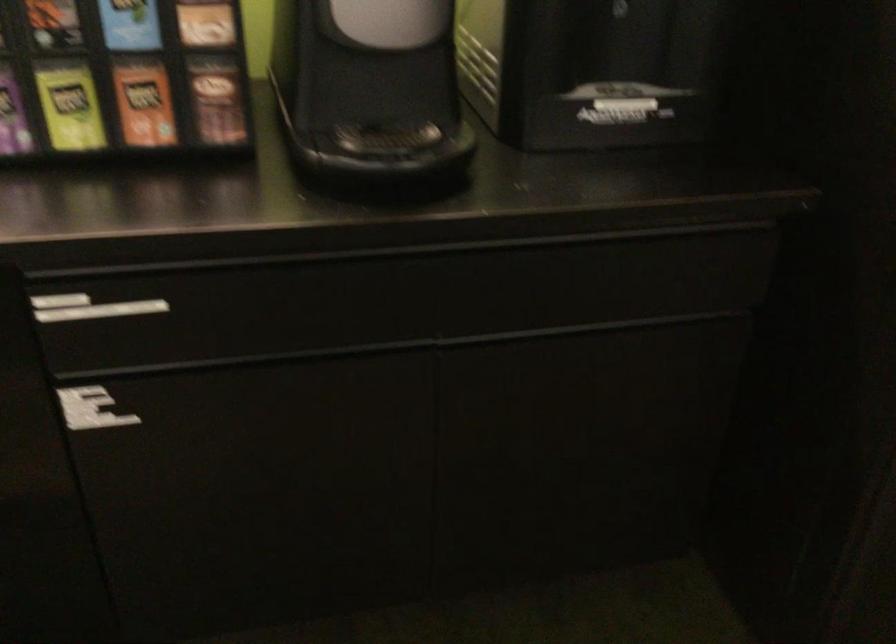
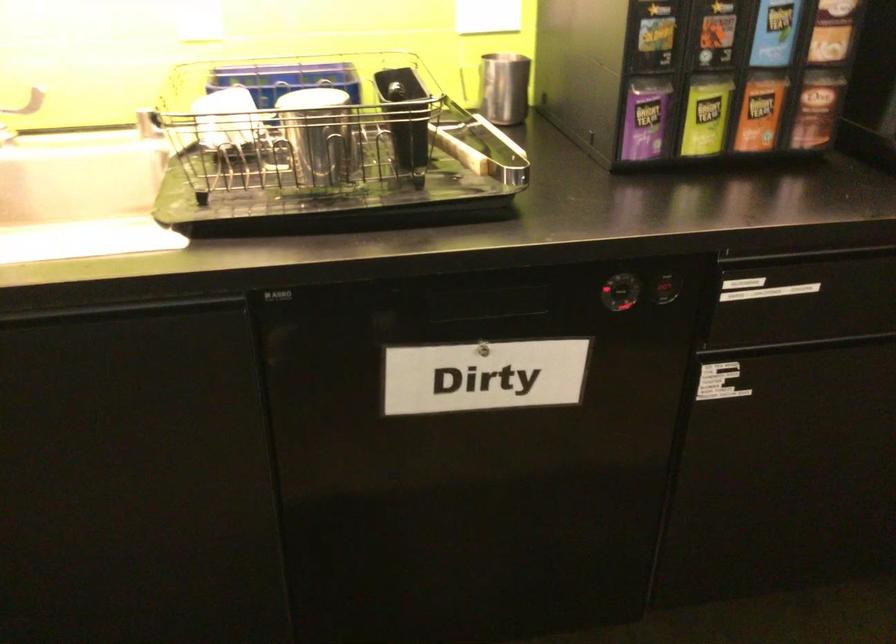
Question: Which direction would the cameraman need to move to produce the second image? Reply with the corresponding letter.

Choices:
 (A) Left
 (B) Right
 (C) Forward
 (D) Backward

Answer: (A)